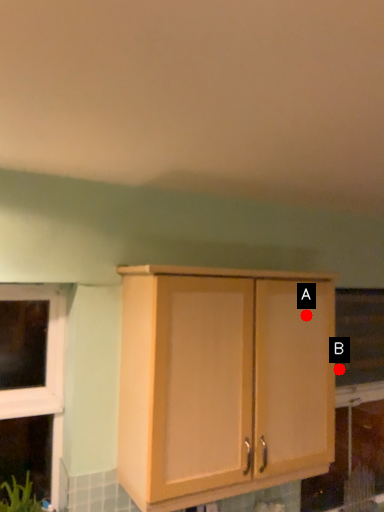
Question: Two points are circled on the image, labeled by A and B beside each circle. Which point is closer to the camera?

Choices:
 (A) A is closer
 (B) B is closer

Answer: (A)